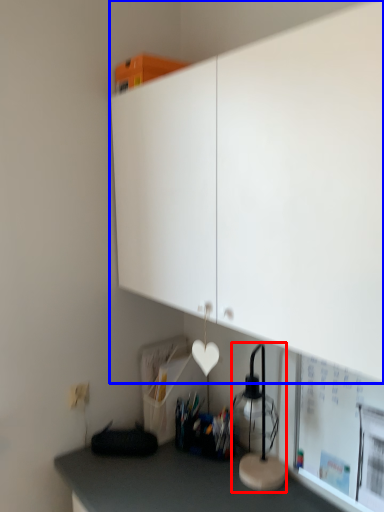
Question: Which of the following is the farthest to the observer, table lamp (highlighted by a red box) or cabinetry (highlighted by a blue box)?

Choices:
 (A) table lamp
 (B) cabinetry

Answer: (A)